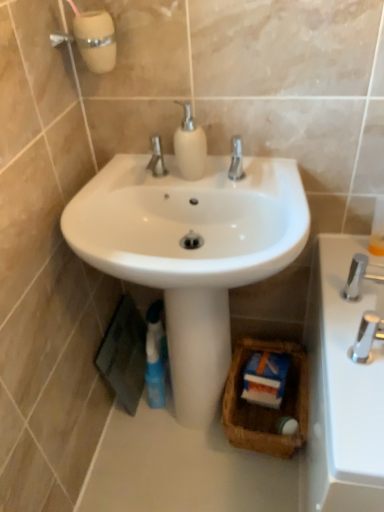
Question: Is brown woven basket at center wider than blue glossy mouthwash at lower center?

Choices:
 (A) no
 (B) yes

Answer: (B)

Question: Can you confirm if brown woven basket at center is positioned to the left of blue glossy mouthwash at lower center?

Choices:
 (A) no
 (B) yes

Answer: (A)

Question: Considering the relative sizes of brown woven basket at center and blue glossy mouthwash at lower center in the image provided, is brown woven basket at center smaller than blue glossy mouthwash at lower center?

Choices:
 (A) no
 (B) yes

Answer: (A)

Question: Is brown woven basket at center positioned with its back to blue glossy mouthwash at lower center?

Choices:
 (A) yes
 (B) no

Answer: (B)

Question: Can blue glossy mouthwash at lower center be found inside brown woven basket at center?

Choices:
 (A) no
 (B) yes

Answer: (A)

Question: From the image's perspective, is brown woven basket at center over blue glossy mouthwash at lower center?

Choices:
 (A) no
 (B) yes

Answer: (A)

Question: Is blue glossy mouthwash at lower center not near brown woven basket at center?

Choices:
 (A) yes
 (B) no

Answer: (B)

Question: Does blue glossy mouthwash at lower center lie behind brown woven basket at center?

Choices:
 (A) yes
 (B) no

Answer: (A)

Question: Is blue glossy mouthwash at lower center wider than brown woven basket at center?

Choices:
 (A) no
 (B) yes

Answer: (A)

Question: From the image's perspective, is blue glossy mouthwash at lower center below brown woven basket at center?

Choices:
 (A) yes
 (B) no

Answer: (B)

Question: Considering the relative sizes of blue glossy mouthwash at lower center and brown woven basket at center in the image provided, is blue glossy mouthwash at lower center thinner than brown woven basket at center?

Choices:
 (A) no
 (B) yes

Answer: (B)

Question: Is blue glossy mouthwash at lower center positioned with its back to brown woven basket at center?

Choices:
 (A) yes
 (B) no

Answer: (B)

Question: Is blue glossy mouthwash at lower center oriented towards chrome metallic faucet at right, the second tap viewed from the back?

Choices:
 (A) yes
 (B) no

Answer: (B)